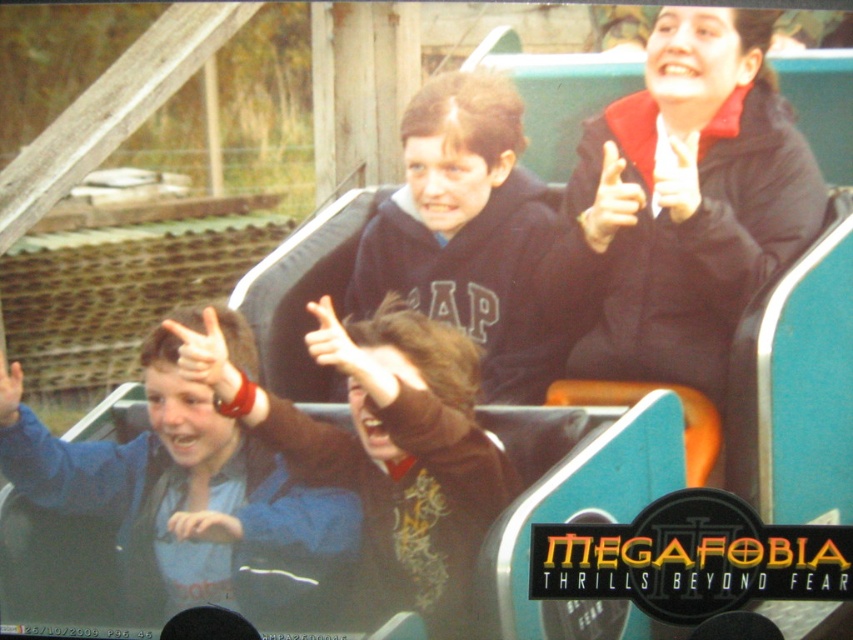
You are a photographer taking a picture of the black matte jacket at upper right and the matte black hand at upper right. Which object should you focus on first if you want to capture both in focus?

The black matte jacket at upper right is located below the matte black hand at upper right. To capture both in focus, you should focus on the matte black hand at upper right first since it is closer to the camera.

Based on the photo, you are a photographer taking a picture of the black matte jacket at upper right and the matte black hand at upper right. Which object will appear closer to the camera in the photo?

The black matte jacket at upper right will appear closer to the camera in the photo because it is in front of the matte black hand at upper right.